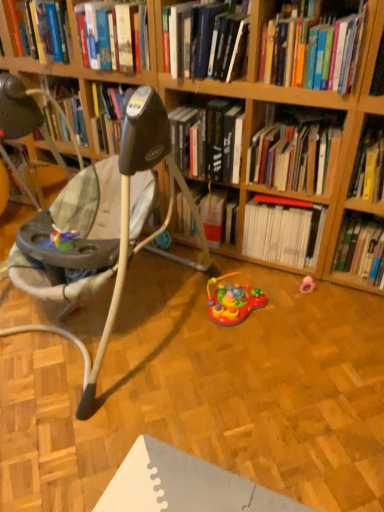
You are a GUI agent. You are given a task and a screenshot of the screen. Output one action in this format:
    pyautogui.click(x=<x>, y=<y>)
    Task: Click on the free space in front of multicolored plastic toy at center, the 1th toy viewed from the left
    Image resolution: width=384 pixels, height=512 pixels.
    Given the screenshot: What is the action you would take?
    pyautogui.click(x=244, y=354)